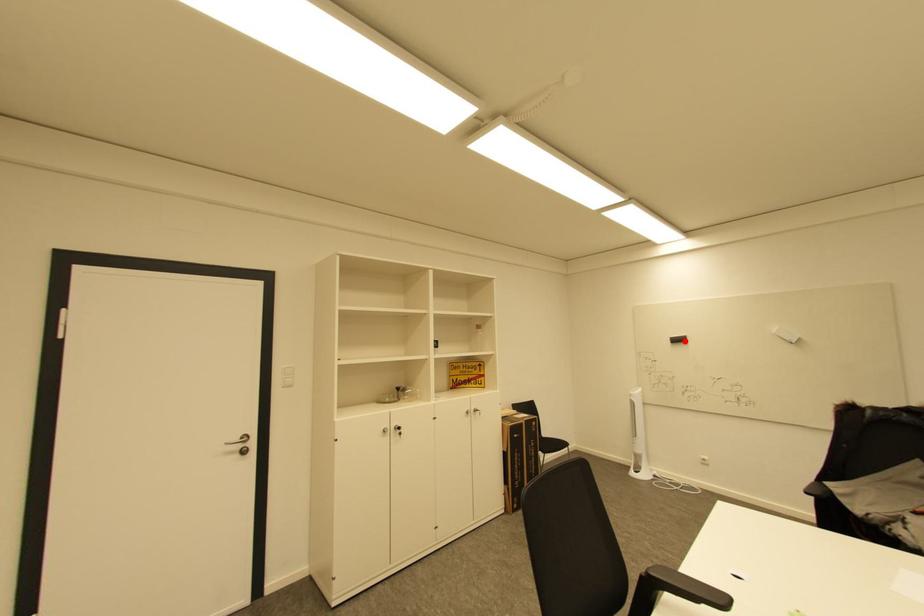
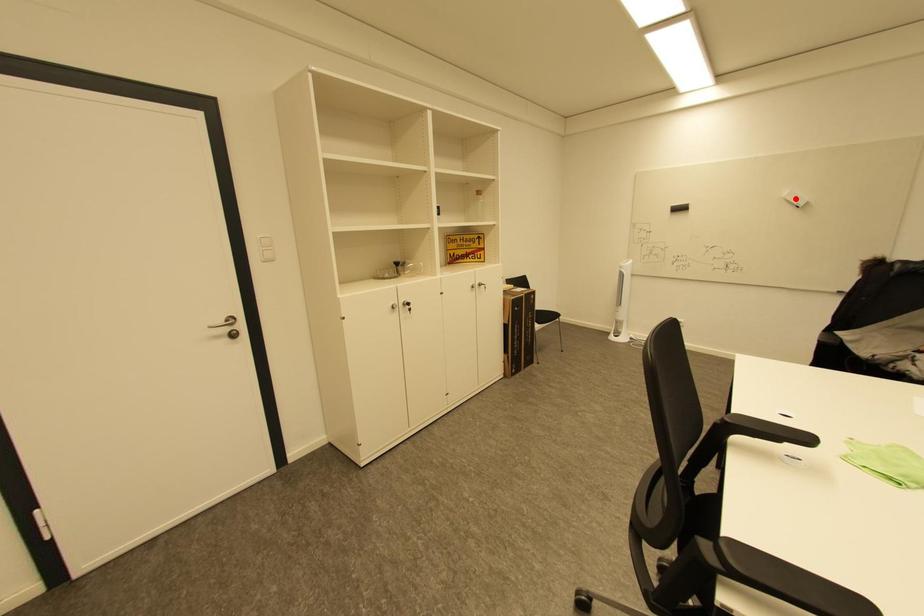
I am providing you with two images of the same scene from different viewpoints. A red point is marked on the first image and another point is marked on the second image. Do the highlighted points in image1 and image2 indicate the same real-world spot?

No